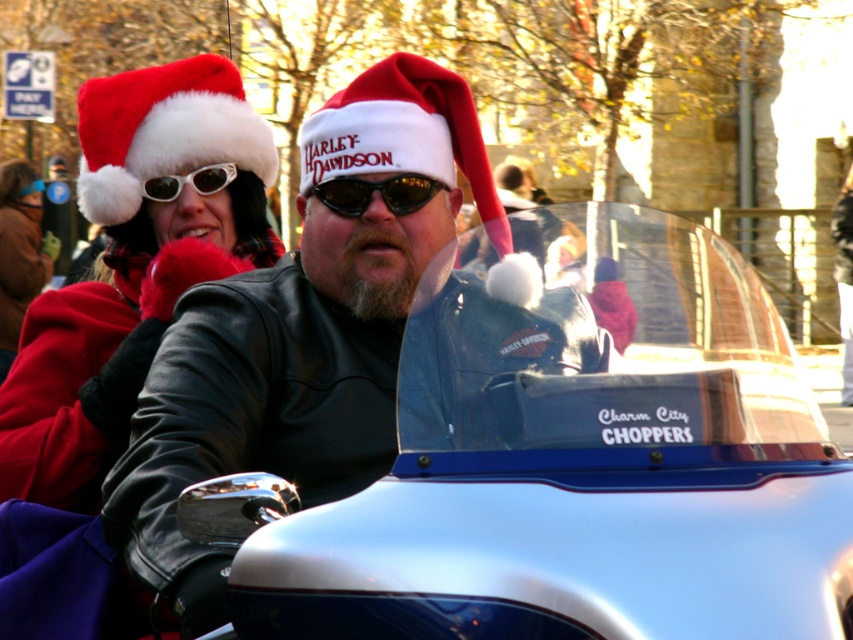
Who is higher up, leather jacket at center or black plastic sunglasses at center?

black plastic sunglasses at center

This screenshot has width=853, height=640. In order to click on leather jacket at center in this screenshot , I will do `click(305, 332)`.

Does point (306, 129) lie in front of point (113, 378)?

That is True.

Locate an element on the screen. This screenshot has width=853, height=640. leather jacket at center is located at coordinates (305, 332).

Describe the element at coordinates (131, 268) in the screenshot. I see `fuzzy red santa hat at upper left` at that location.

Which of these two, fuzzy red santa hat at upper left or black plastic sunglasses at center, stands taller?

Standing taller between the two is fuzzy red santa hat at upper left.

Identify the location of fuzzy red santa hat at upper left. This screenshot has height=640, width=853. (131, 268).

This screenshot has height=640, width=853. I want to click on fuzzy red santa hat at upper left, so click(x=131, y=268).